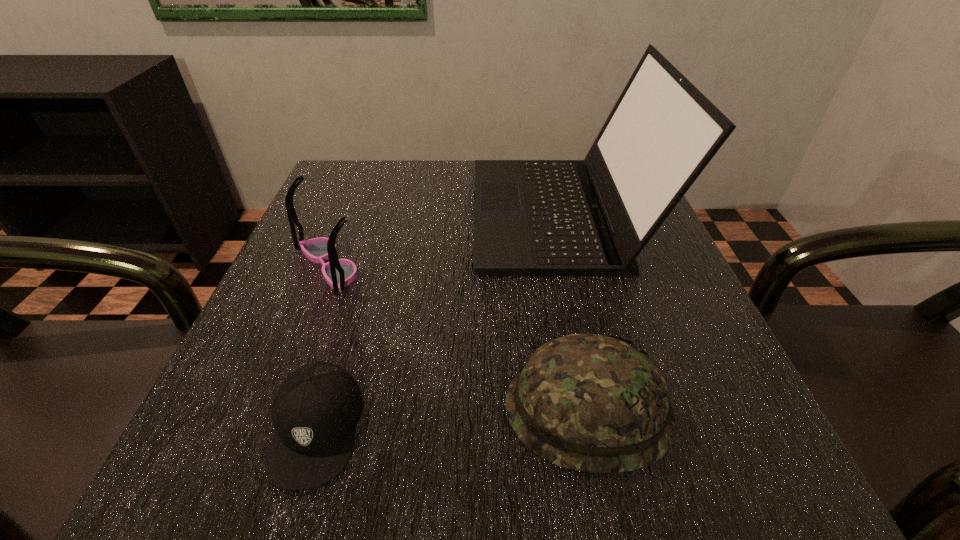
This screenshot has height=540, width=960. Find the location of `blank space located 0.290m on the left of the taller cap`. blank space located 0.290m on the left of the taller cap is located at coordinates point(290,410).

Find the location of a particular element. Image resolution: width=960 pixels, height=540 pixels. object present at the far edge is located at coordinates (592, 217).

This screenshot has height=540, width=960. Identify the location of spectacles situated at the left edge. (338, 273).

Locate an element on the screen. This screenshot has width=960, height=540. cap situated at the left edge is located at coordinates (314, 413).

Find the location of a particular element. laptop located in the right edge section of the desktop is located at coordinates (592, 217).

Identify the location of headwear at the right edge. The image size is (960, 540). (588, 402).

Locate an element on the screen. The width and height of the screenshot is (960, 540). object positioned at the near left corner is located at coordinates (314, 413).

Identify the location of object that is positioned at the far right corner. Image resolution: width=960 pixels, height=540 pixels. (592, 217).

Where is `object located at the near right corner`? This screenshot has height=540, width=960. object located at the near right corner is located at coordinates (588, 402).

I want to click on free space at the far edge of the desktop, so click(460, 164).